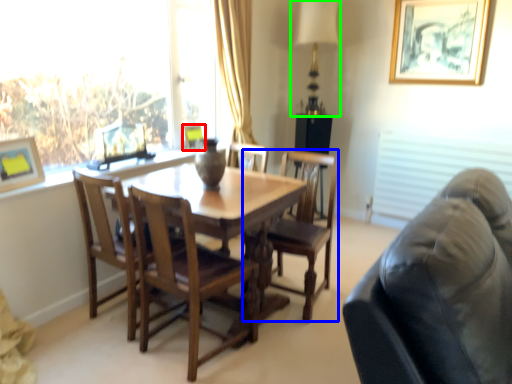
Question: Estimate the real-world distances between objects in this image. Which object is farther from picture frame (highlighted by a red box), chair (highlighted by a blue box) or table lamp (highlighted by a green box)?

Choices:
 (A) chair
 (B) table lamp

Answer: (B)